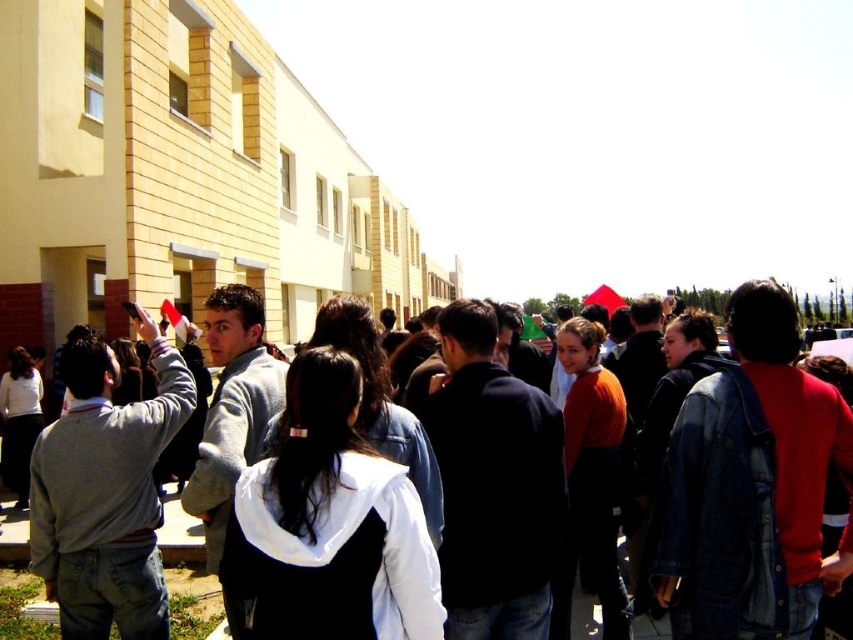
Is point (347, 493) closer to viewer compared to point (202, 552)?

Yes.

Is white matte jacket at center further to the viewer compared to denim jacket at center?

No, it is in front of denim jacket at center.

Does point (401, 566) come closer to viewer compared to point (579, 625)?

Yes, point (401, 566) is closer to viewer.

Where is `white matte jacket at center`? This screenshot has width=853, height=640. white matte jacket at center is located at coordinates (328, 525).